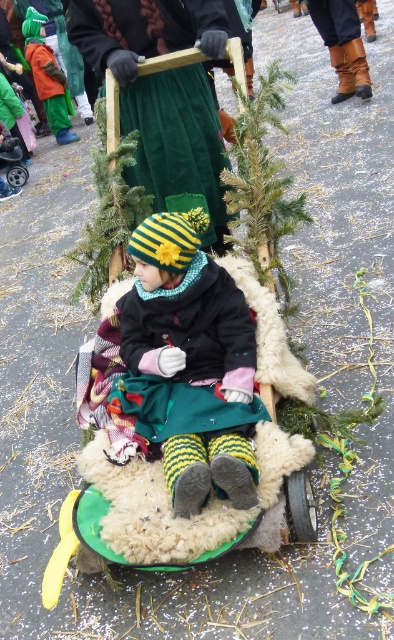
Is point (206, 442) more distant than point (102, 13)?

No, (206, 442) is in front of (102, 13).

Does knitted woolen hat at center have a lesser width compared to velvety green skirt at center?

Yes.

Describe the element at coordinates (189, 364) in the screenshot. I see `knitted woolen hat at center` at that location.

The image size is (394, 640). In order to click on knitted woolen hat at center in this screenshot , I will do `click(189, 364)`.